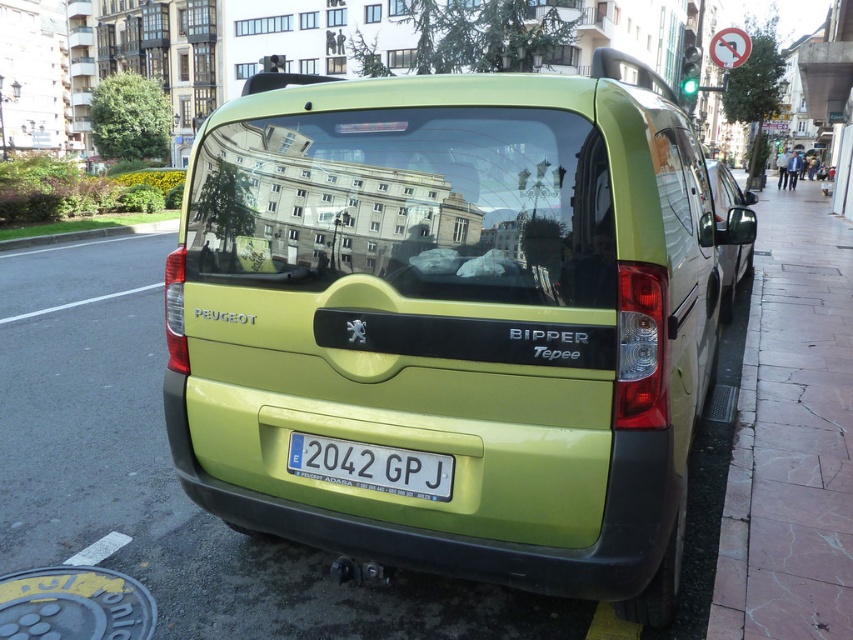
You are a delivery driver who needs to park your lime matte van at center in a spot that requires the license plate to be visible. Based on the scene, can you confirm if the white plastic license plate at center is positioned in a way that allows visibility when the van is parked?

The lime matte van at center is to the left of the white plastic license plate at center, so the license plate is positioned on the right side of the van. Since the van is parked on the right side of the road, the license plate would be visible to traffic officers from behind, fulfilling the visibility requirement.

You are a delivery driver who needs to park a lime matte van at center and a green matte van at right in a narrow alley. Based on the scene, which van can be parked first without blocking the other?

The lime matte van at center occupies less space than the green matte van at right, so the lime matte van at center can be parked first without blocking the other.